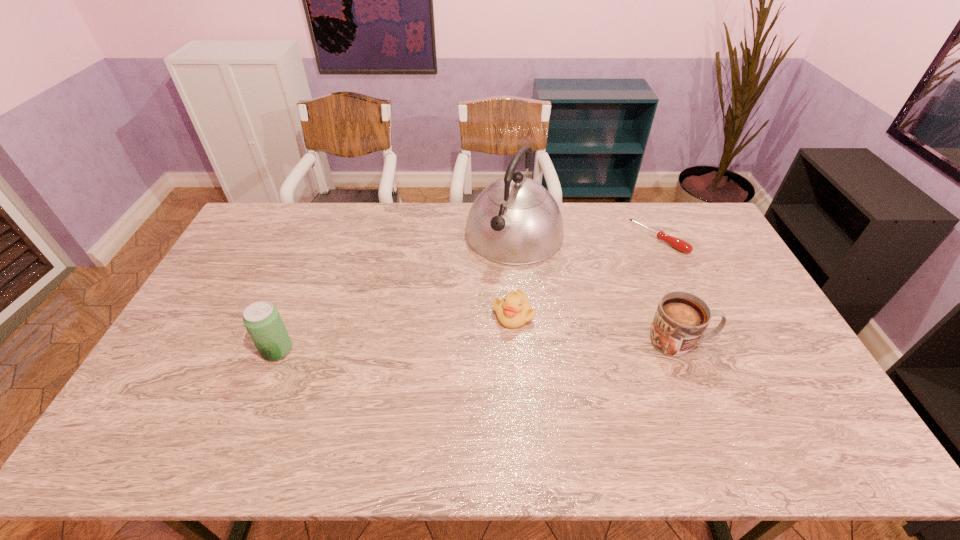
In order to click on vacant space in between the kettle and the shortest object in this screenshot , I will do `click(587, 236)`.

Image resolution: width=960 pixels, height=540 pixels. I want to click on vacant region between the soda and the fourth tallest object, so click(x=396, y=332).

You are a GUI agent. You are given a task and a screenshot of the screen. Output one action in this format:
    pyautogui.click(x=<x>, y=<y>)
    Task: Click on the vacant space that's between the mug and the leftmost object
    Image resolution: width=960 pixels, height=540 pixels.
    Given the screenshot: What is the action you would take?
    pyautogui.click(x=479, y=346)

The image size is (960, 540). I want to click on vacant area between the duckling and the tallest object, so click(x=514, y=274).

Find the location of a particular element. unoccupied area between the soda and the kettle is located at coordinates (396, 292).

The height and width of the screenshot is (540, 960). I want to click on vacant point located between the mug and the duckling, so click(x=597, y=328).

The height and width of the screenshot is (540, 960). I want to click on the closest object relative to the second shortest object, so click(x=516, y=221).

Locate which object ranks fourth in proximity to the kettle. Please provide its 2D coordinates. Your answer should be formatted as a tuple, i.e. [(x, y)], where the tuple contains the x and y coordinates of a point satisfying the conditions above.

[(262, 320)]

The image size is (960, 540). Find the location of `vacant position in the image that satisfies the following two spatial constraints: 1. on the front side of the mug; 2. on the side of the duckling with the handle`. vacant position in the image that satisfies the following two spatial constraints: 1. on the front side of the mug; 2. on the side of the duckling with the handle is located at coordinates (516, 342).

Find the location of `vacant space that satisfies the following two spatial constraints: 1. on the front side of the mug; 2. on the side of the tallest object with the handle`. vacant space that satisfies the following two spatial constraints: 1. on the front side of the mug; 2. on the side of the tallest object with the handle is located at coordinates (524, 342).